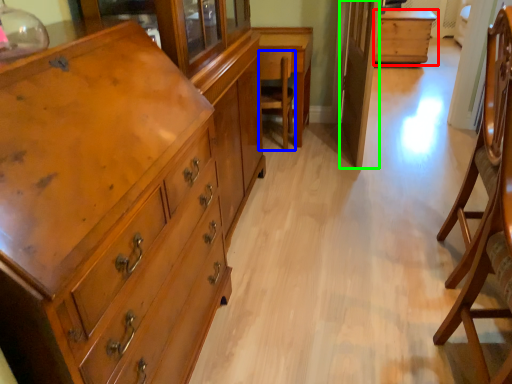
Question: Which object is positioned closest to table (highlighted by a red box)? Select from armchair (highlighted by a blue box) and glass door (highlighted by a green box).

Choices:
 (A) armchair
 (B) glass door

Answer: (B)